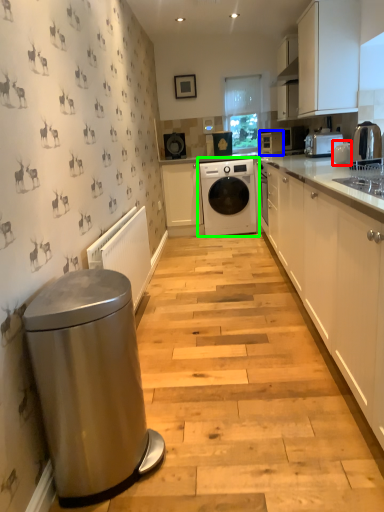
Question: Considering the real-world distances, which object is farthest from appliance (highlighted by a red box)? appliance (highlighted by a blue box) or washing machine (highlighted by a green box)?

Choices:
 (A) appliance
 (B) washing machine

Answer: (B)